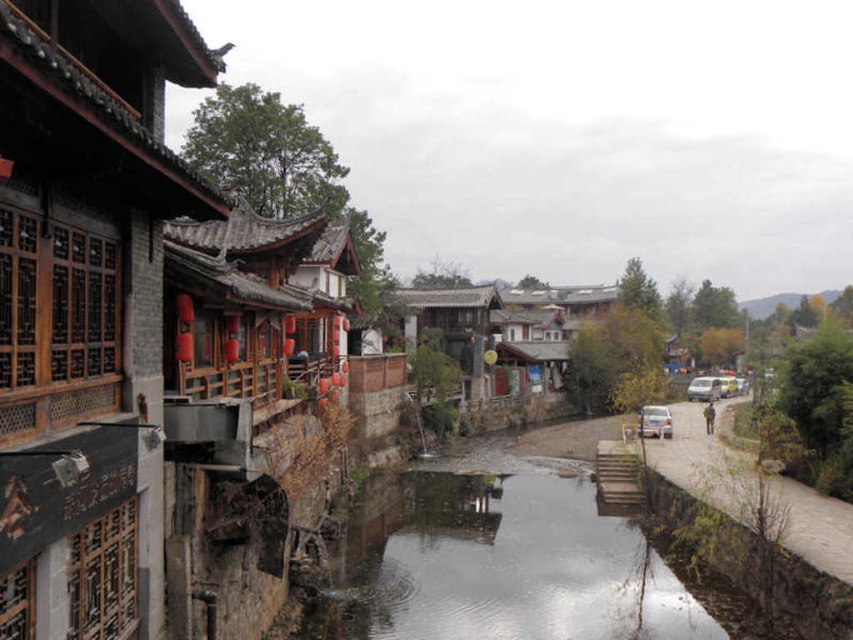
Based on the photo, measure the distance from clear concrete river at center to white matte car at center.

clear concrete river at center and white matte car at center are 11.46 meters apart from each other.

Can you confirm if clear concrete river at center is positioned above white matte car at center?

Actually, clear concrete river at center is below white matte car at center.

Is point (457, 536) closer to viewer compared to point (666, 436)?

Yes, point (457, 536) is in front of point (666, 436).

Locate an element on the screen. The height and width of the screenshot is (640, 853). clear concrete river at center is located at coordinates (497, 564).